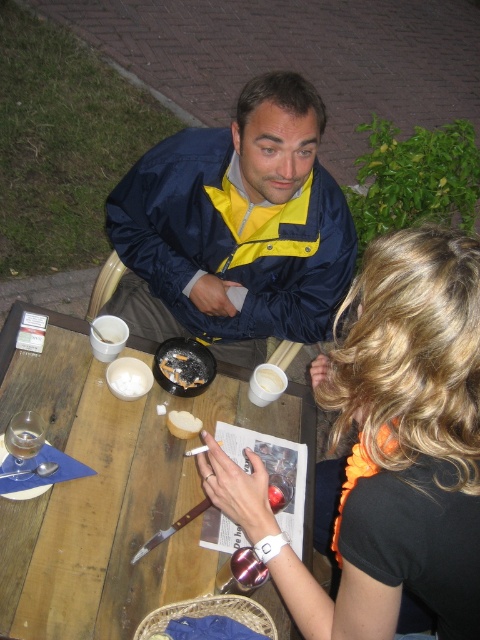
Between white matte bread at upper center and white matte bread at center, which one is positioned higher?

white matte bread at center is above.

Is white matte bread at upper center bigger than white matte bread at center?

Yes.

Measure the distance between white matte bread at upper center and camera.

They are 1.43 meters apart.

The height and width of the screenshot is (640, 480). What are the coordinates of `white matte bread at upper center` in the screenshot? It's located at (129, 381).

Does wooden table at center appear over crumbly brown bread at table center?

No, wooden table at center is not above crumbly brown bread at table center.

Which of these two, wooden table at center or crumbly brown bread at table center, stands taller?

wooden table at center is taller.

The image size is (480, 640). Describe the element at coordinates (113, 490) in the screenshot. I see `wooden table at center` at that location.

Identify the location of wooden table at center. This screenshot has height=640, width=480. (113, 490).

Which of these two, white matte bread at upper center or white bread at table center, stands shorter?

white bread at table center

Can you confirm if white matte bread at upper center is thinner than white bread at table center?

No, white matte bread at upper center is not thinner than white bread at table center.

Consider the image. Who is more forward, (x=110, y=387) or (x=175, y=416)?

Point (x=175, y=416) is in front.

Identify the location of white matte bread at upper center. This screenshot has height=640, width=480. (129, 381).